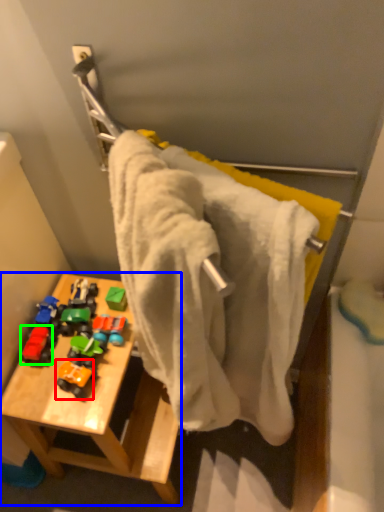
Question: Which object is positioned closest to toy (highlighted by a red box)? Select from furniture (highlighted by a blue box) and toy (highlighted by a green box).

Choices:
 (A) furniture
 (B) toy

Answer: (B)